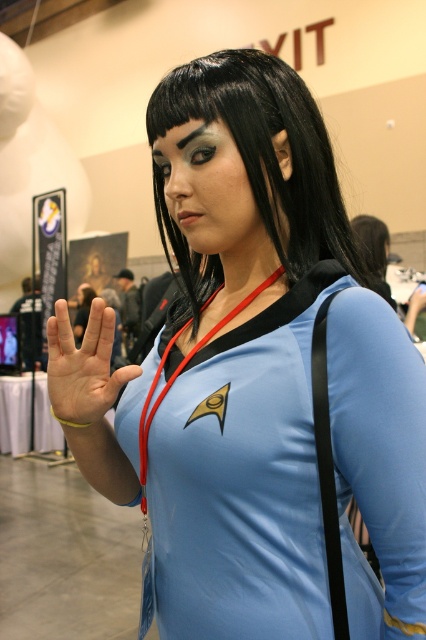
Question: Does black smooth hair at center appear on the right side of light skin palm at center?

Choices:
 (A) no
 (B) yes

Answer: (B)

Question: Which point is closer to the camera taking this photo?

Choices:
 (A) (106, 342)
 (B) (146, 106)

Answer: (A)

Question: Which object appears farthest from the camera in this image?

Choices:
 (A) black smooth hair at center
 (B) light skin palm at center

Answer: (B)

Question: Can you confirm if black smooth hair at center is positioned to the left of light skin palm at center?

Choices:
 (A) yes
 (B) no

Answer: (B)

Question: Observing the image, what is the correct spatial positioning of black smooth hair at center in reference to light skin palm at center?

Choices:
 (A) below
 (B) above

Answer: (B)